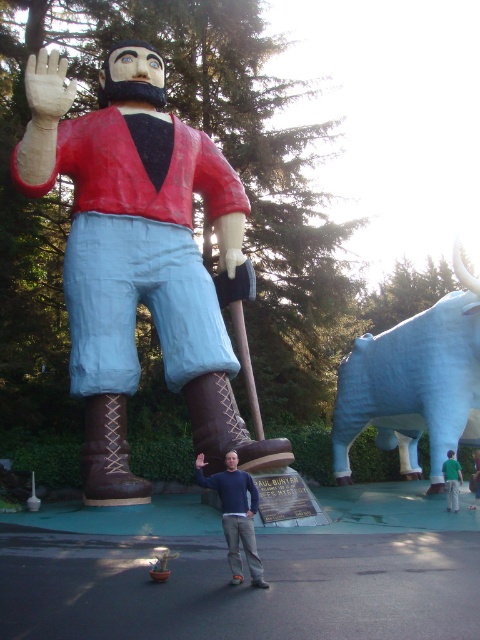
Is blue jeans at center below green fabric shirt at lower right?

Actually, blue jeans at center is above green fabric shirt at lower right.

Between blue jeans at center and green fabric shirt at lower right, which one appears on the left side from the viewer's perspective?

From the viewer's perspective, blue jeans at center appears more on the left side.

Is point (232, 467) farther from camera compared to point (478, 472)?

That is False.

The width and height of the screenshot is (480, 640). I want to click on blue jeans at center, so click(x=236, y=515).

Is matte papier-mâché figure at center shorter than brown woven fabric pole at center?

No, matte papier-mâché figure at center is not shorter than brown woven fabric pole at center.

Is matte papier-mâché figure at center positioned before brown woven fabric pole at center?

Yes.

Locate an element on the screen. The height and width of the screenshot is (640, 480). matte papier-mâché figure at center is located at coordinates (136, 252).

Locate an element on the screen. matte papier-mâché figure at center is located at coordinates (136, 252).

Can you confirm if blue fabric bull at right is thinner than green fabric shirt at lower center?

No, blue fabric bull at right is not thinner than green fabric shirt at lower center.

This screenshot has width=480, height=640. What are the coordinates of `blue fabric bull at right` in the screenshot? It's located at (415, 384).

You are a GUI agent. You are given a task and a screenshot of the screen. Output one action in this format:
    pyautogui.click(x=<x>, y=<y>)
    Task: Click on the blue fabric bull at right
    This screenshot has height=640, width=480.
    Given the screenshot: What is the action you would take?
    pyautogui.click(x=415, y=384)